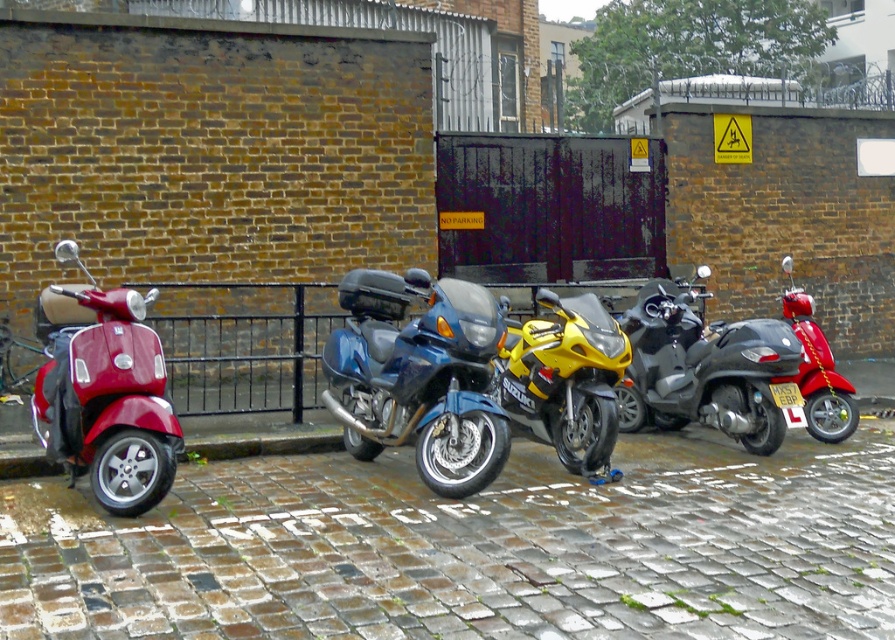
You are a delivery person who needs to choose between the yellow metallic motorcycle at center and the shiny red scooter at right for a quick delivery. Based on their sizes, which vehicle would be more suitable for carrying packages?

The yellow metallic motorcycle at center is larger in size than the shiny red scooter at right, so it would be more suitable for carrying packages due to its bigger capacity.

You are standing at the origin point of the coordinate system, which is the bottom left corner of the image. You want to move towards the blue metallic motorcycle at center. What direction should you move in to reach it?

Since the blue metallic motorcycle at center has coordinates at point (419, 376), you should move northeast to reach it. The x coordinate is greater than 0.5, meaning east direction, and the y coordinate is 0.469, which is slightly north from the bottom edge.